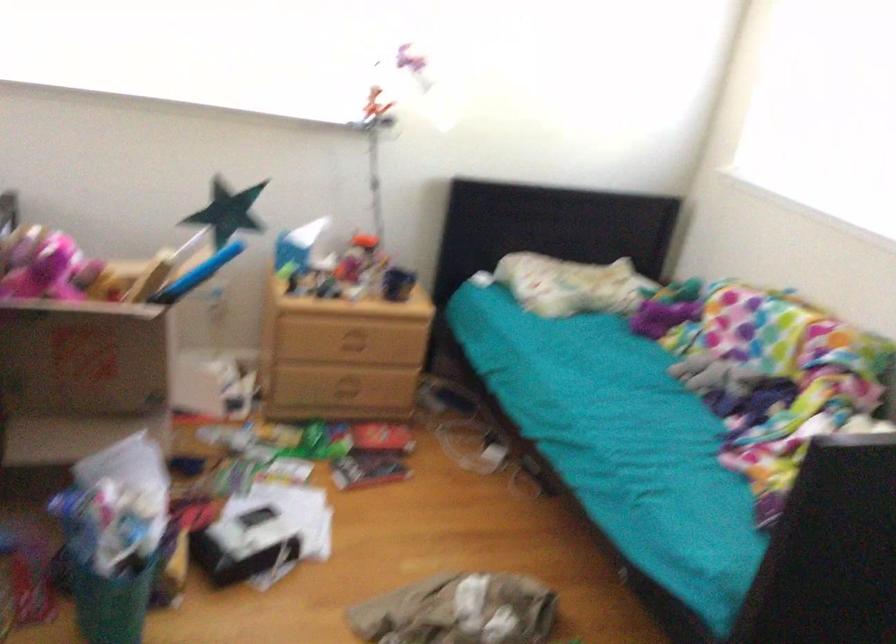
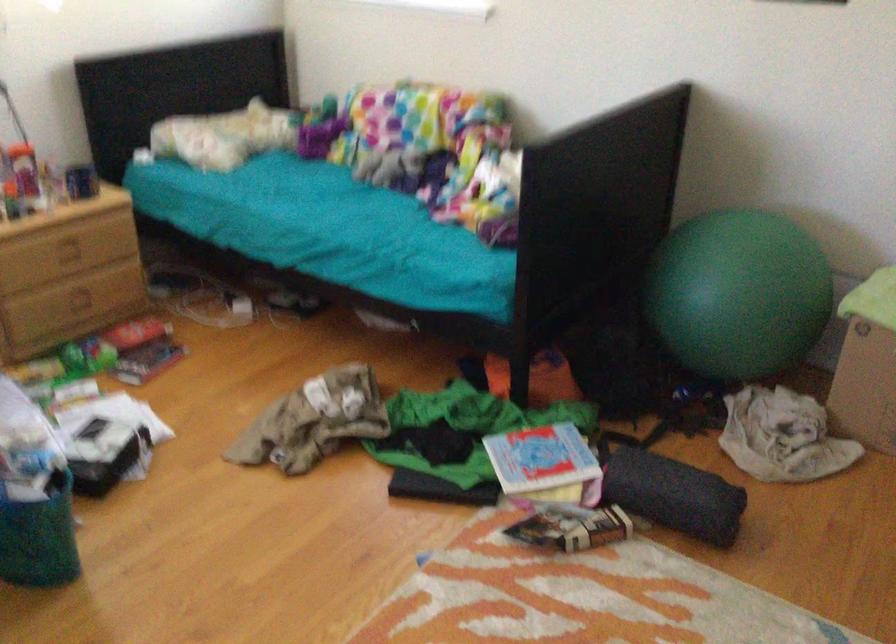
Question: The first image is from the beginning of the video and the second image is from the end. How did the camera likely rotate when shooting the video?

Choices:
 (A) Left
 (B) Right
 (C) Up
 (D) Down

Answer: (B)